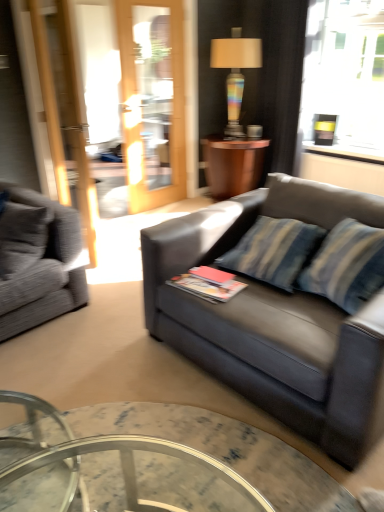
Question: Looking at their shapes, would you say marble glass coffee table at center is wider or thinner than rainbow glass lamp at upper center?

Choices:
 (A) wide
 (B) thin

Answer: (A)

Question: From a real-world perspective, relative to rainbow glass lamp at upper center, is marble glass coffee table at center vertically above or below?

Choices:
 (A) below
 (B) above

Answer: (A)

Question: Estimate the real-world distances between objects in this image. Which object is farther from the marble glass coffee table at center?

Choices:
 (A) gray fabric couch at left, marked as the second studio couch in a right-to-left arrangement
 (B) rainbow glass lamp at upper center
 (C) slate gray leather couch at center, which is counted as the 2th studio couch, starting from the left
 (D) wooden side table at center
 (E) matte paper book at center

Answer: (B)

Question: Considering the real-world distances, which object is farthest from the matte paper book at center?

Choices:
 (A) wooden side table at center
 (B) marble glass coffee table at center
 (C) gray fabric couch at left, marked as the second studio couch in a right-to-left arrangement
 (D) rainbow glass lamp at upper center
 (E) slate gray leather couch at center, which is the 1th studio couch in right-to-left order

Answer: (D)